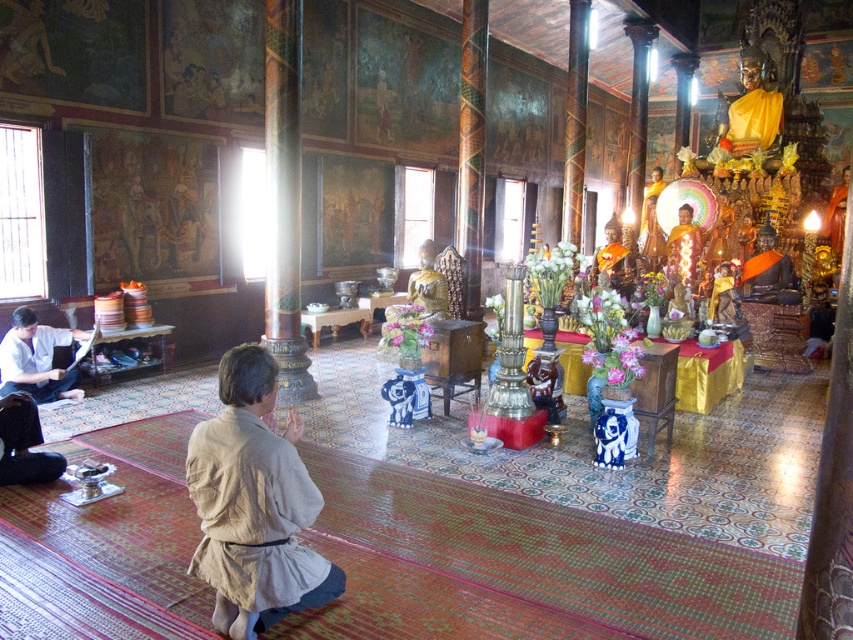
You are a visitor in the temple and see the beige linen robe at lower center and the white paper at left. Which object is closer to the floor?

The beige linen robe at lower center is closer to the floor because it is located below the white paper at left.

You are an architect designing a new temple and want to ensure the kneeling area is accessible for all visitors. Given the beige linen robe at lower center and the white paper at left, which object is taller and must be considered for clearance?

The beige linen robe at lower center is taller than the white paper at left, so clearance must be designed to accommodate the height of the beige linen robe at lower center.